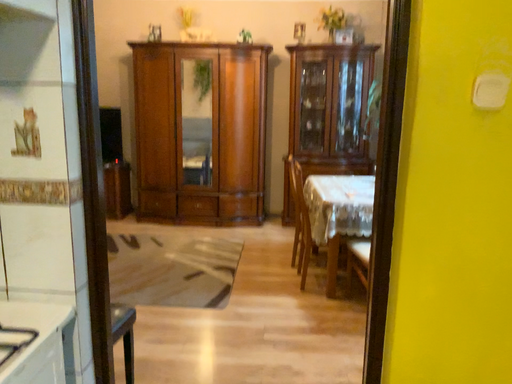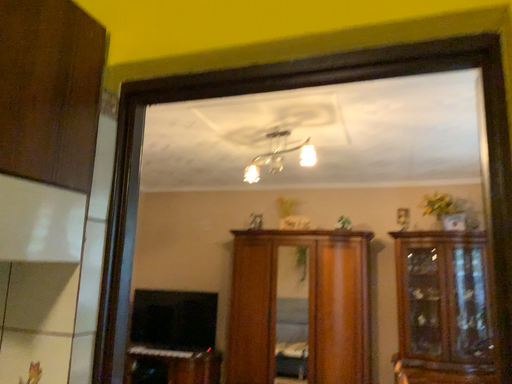
Question: How did the camera likely rotate when shooting the video?

Choices:
 (A) rotated upward
 (B) rotated downward

Answer: (A)